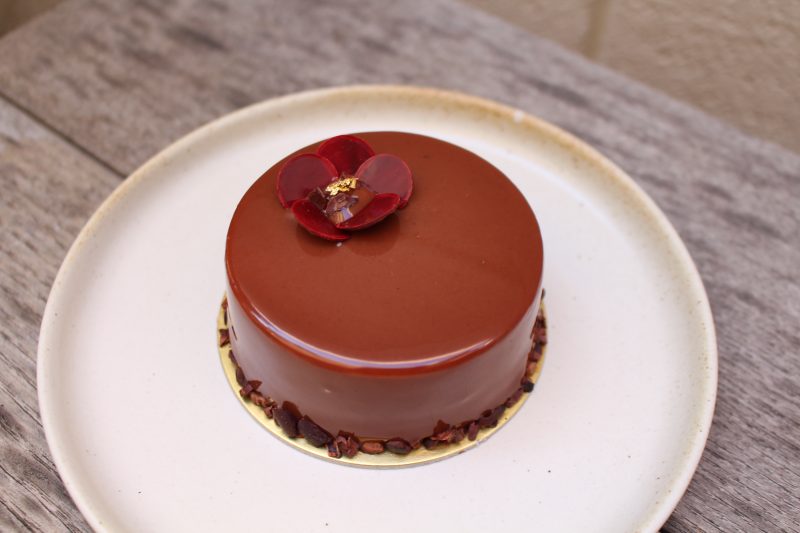
The image size is (800, 533). In order to click on plate in this screenshot , I will do `click(573, 419)`.